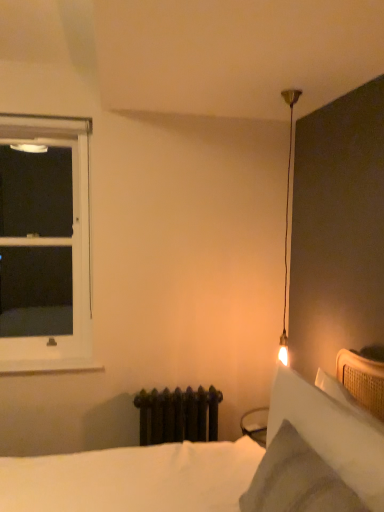
The height and width of the screenshot is (512, 384). Find the location of `vacant area on top of white matte window sill at lower left (from a real-world perspective)`. vacant area on top of white matte window sill at lower left (from a real-world perspective) is located at coordinates (48, 356).